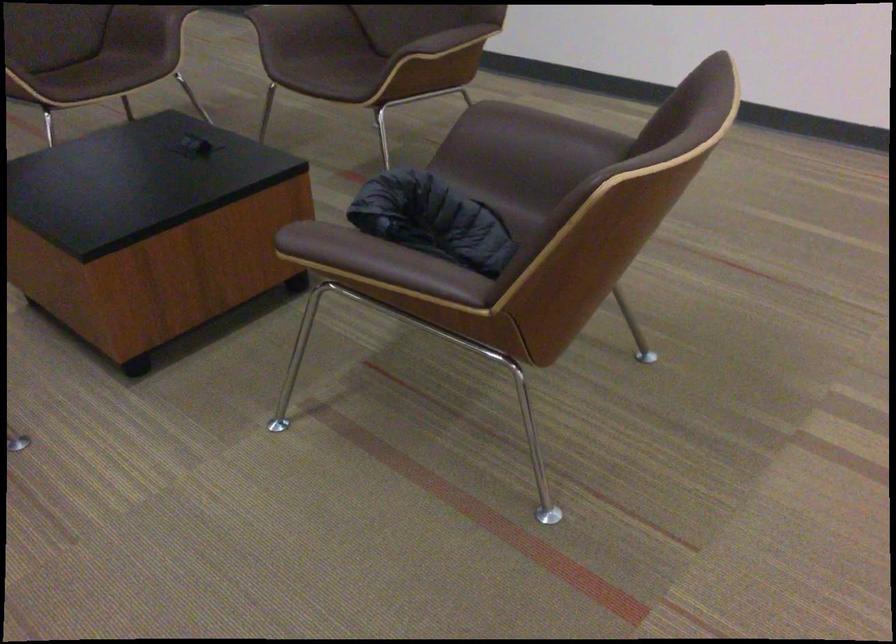
This screenshot has width=896, height=644. I want to click on brown chair sitting surface, so click(x=343, y=70).